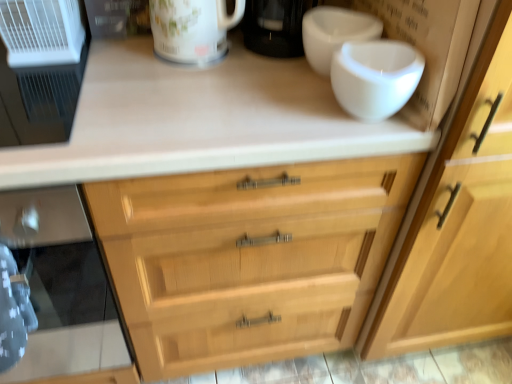
Find the location of a particular element. Image resolution: width=512 pixels, height=384 pixels. vacant area that lies in front of white glossy bowl at upper right is located at coordinates (301, 120).